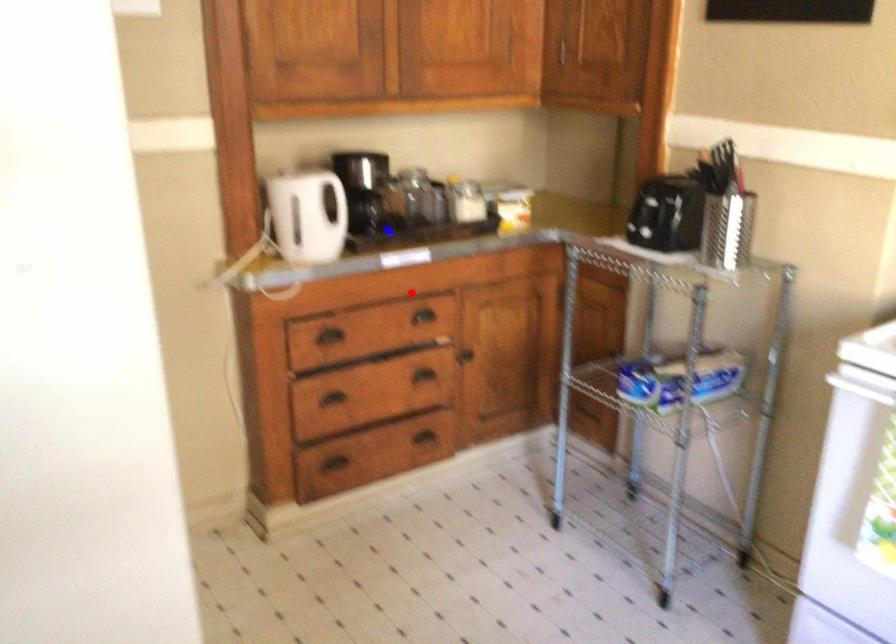
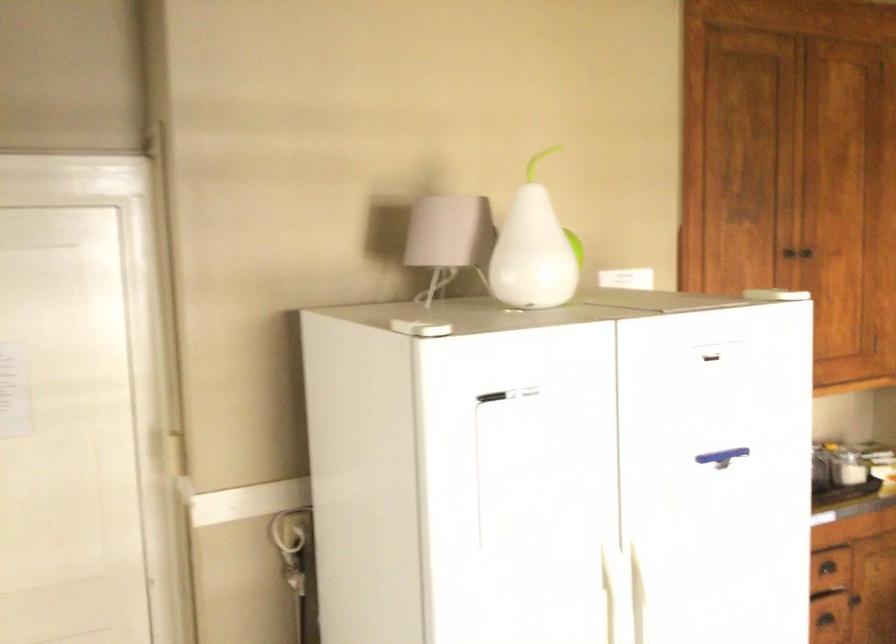
In the second image, find the point that corresponds to the highlighted location in the first image.

(826, 567)